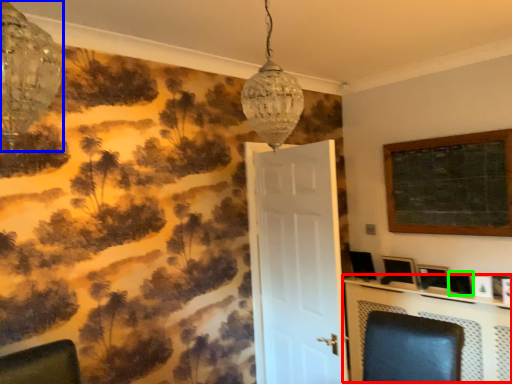
Question: Considering the real-world distances, which object is farthest from table (highlighted by a red box)? lamp (highlighted by a blue box) or picture frame (highlighted by a green box)?

Choices:
 (A) lamp
 (B) picture frame

Answer: (A)